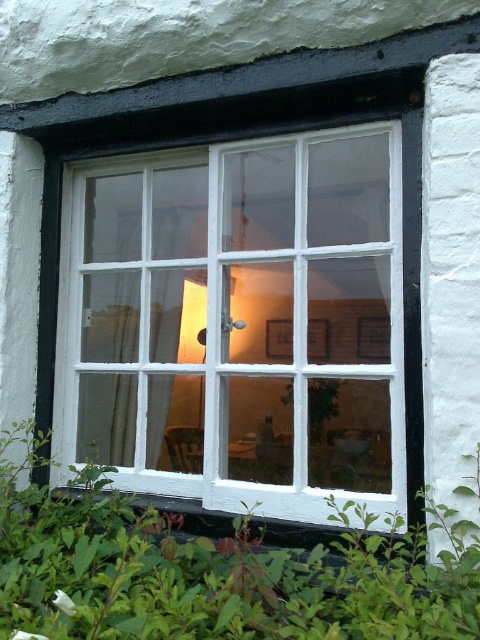
You are a window cleaner with a 24 inch ladder. You need to reach both the white wooden window at center and the green leafy plant at lower center. Can you reach both with the ladder?

The white wooden window at center is 20.51 inches from the green leafy plant at lower center, so yes, the ladder can reach both since it is 24 inches long, which is longer than the distance between them.

Looking at this image, you are standing outside the building and want to hang a new picture on the wall inside the room. The picture is as tall as the green leafy plant at lower center. Will the white wooden window at center block your view of the picture when looking through the window?

The white wooden window at center is much taller than the green leafy plant at lower center. Since the picture is as tall as the green leafy plant at lower center, the window will block part of the picture when viewed from outside because the window is taller and may cover the upper portion of the picture.

You are standing outside the building and want to take a photo of the white wooden window at center without any obstruction. Is the green leafy plant at lower center blocking your view of the window?

The green leafy plant at lower center is behind the white wooden window at center, so it is not blocking the view of the window from the outside. You can take the photo without any obstruction.